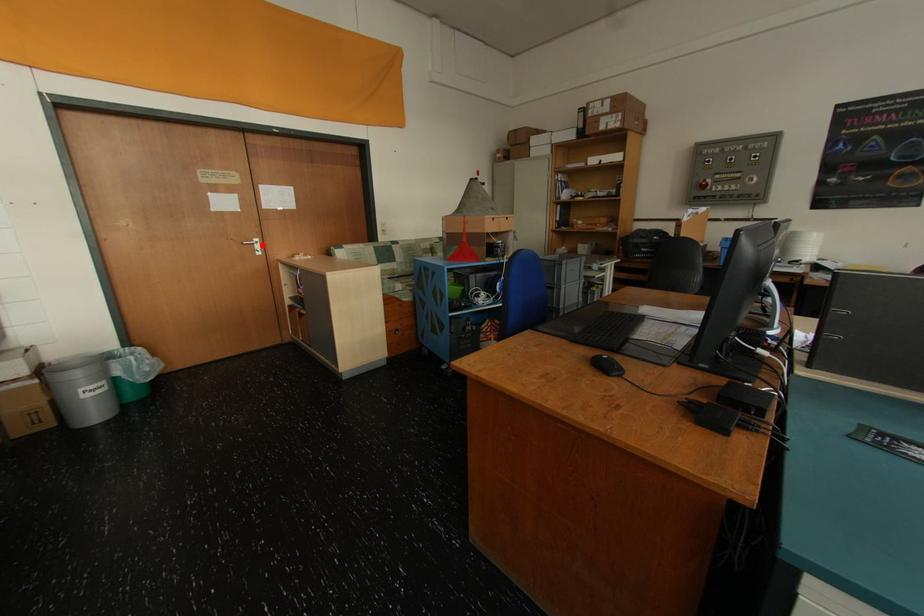
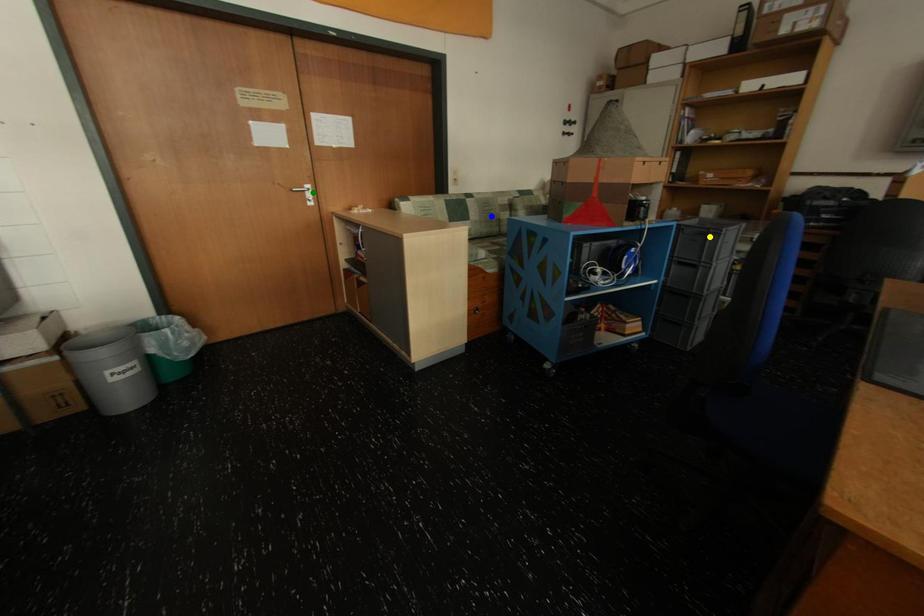
Question: I am providing you with two images of the same scene from different viewpoints. A red point is marked on the first image. You are given multiple points on the second image. Can you choose the point in image 2 that corresponds to the point in image 1?

Choices:
 (A) blue point
 (B) yellow point
 (C) green point

Answer: (C)